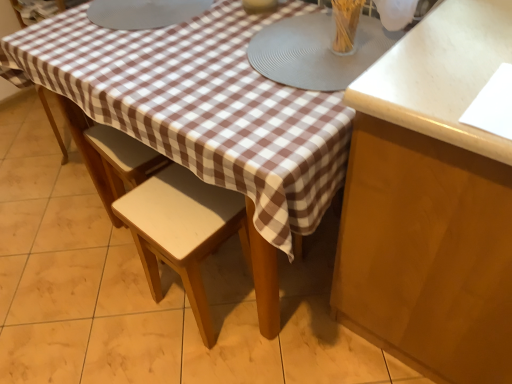
At what (x,y) coordinates should I click in order to perform the action: click on free spot to the right of clear glass vase at upper center. Please return your answer as a coordinate pair (x, y). The height and width of the screenshot is (384, 512). Looking at the image, I should click on (377, 43).